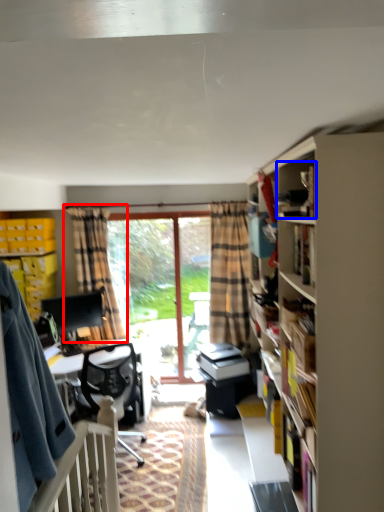
Question: Which object appears farthest to the camera in this image, curtain (highlighted by a red box) or book (highlighted by a blue box)?

Choices:
 (A) curtain
 (B) book

Answer: (A)